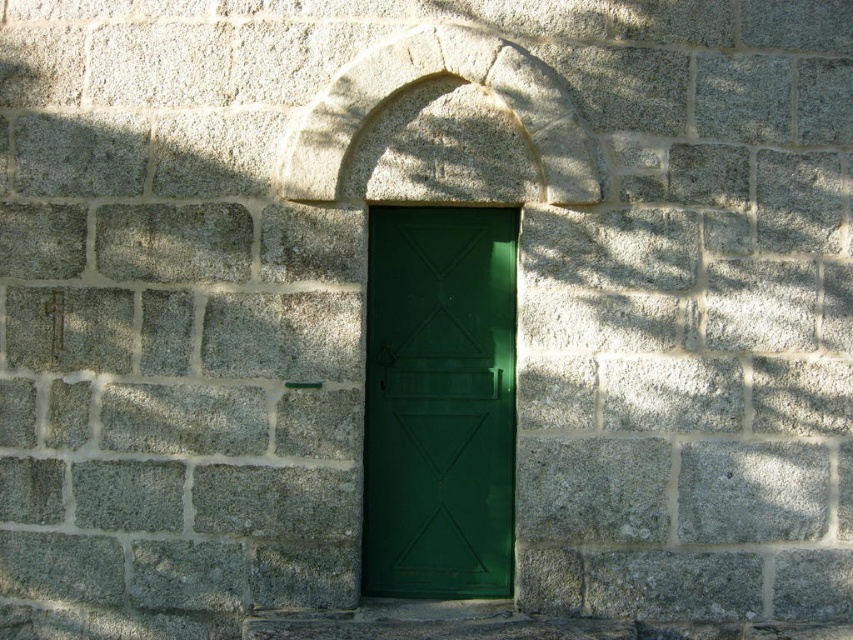
You are a painter who needs to know the height of the green matte door at center and the gray stone arch at center to prepare your supplies. Which one is taller?

The green matte door at center is taller than the gray stone arch at center.

You are standing in front of a stone wall with a green door and an arch. The green matte door at center and the gray stone arch at center are both in view. Which object is positioned to the right side of the other?

The green matte door at center is to the right of the gray stone arch at center.

You are standing in front of the stone wall with the green door. There are two points marked on the wall at coordinates point (442, 216) and point (320, 140). Which point is closer to you?

Point (442, 216) is further to the viewer than point (320, 140), so the closer point to you is point (320, 140).